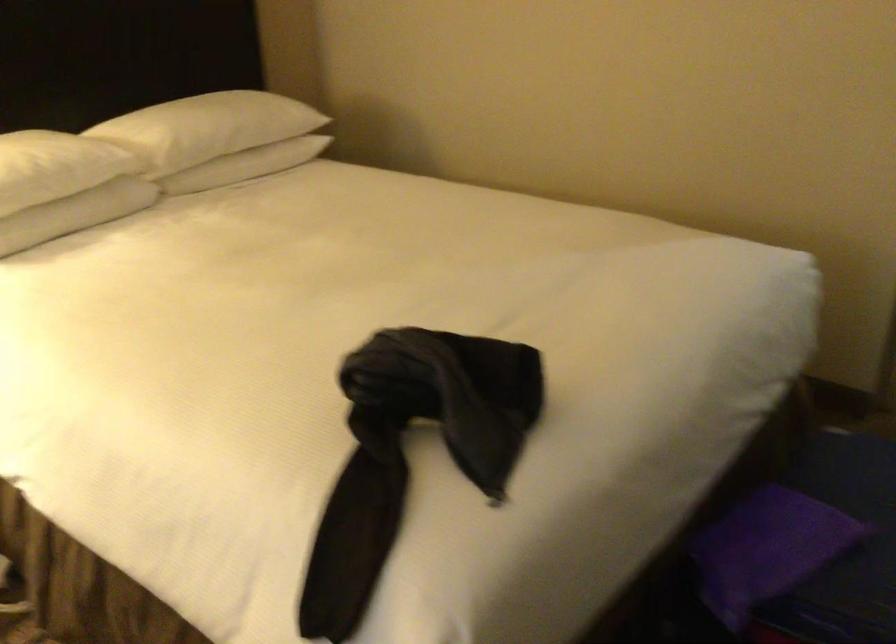
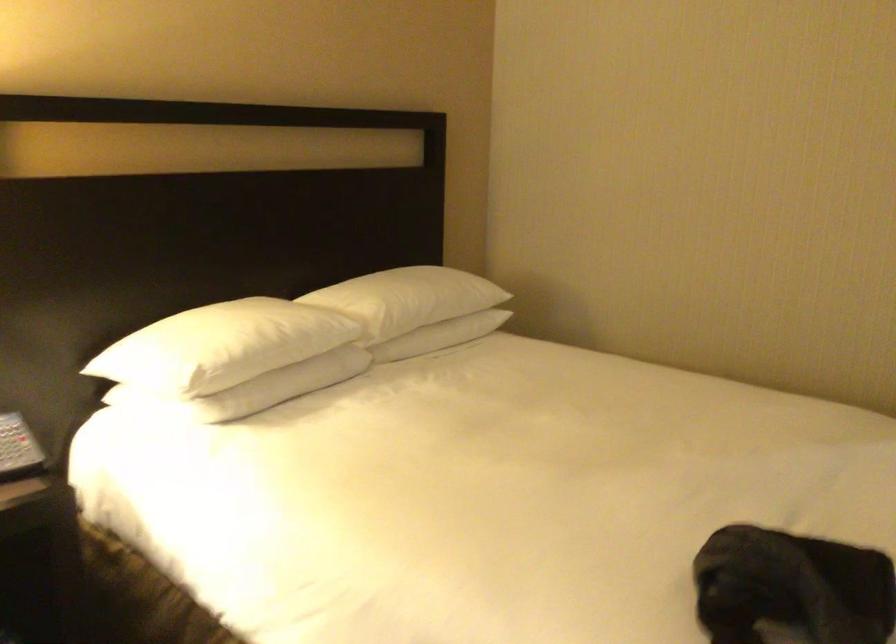
Question: Based on the continuous images, in which direction is the camera rotating? Reply with the corresponding letter.

Choices:
 (A) Left
 (B) Right
 (C) Up
 (D) Down

Answer: (C)